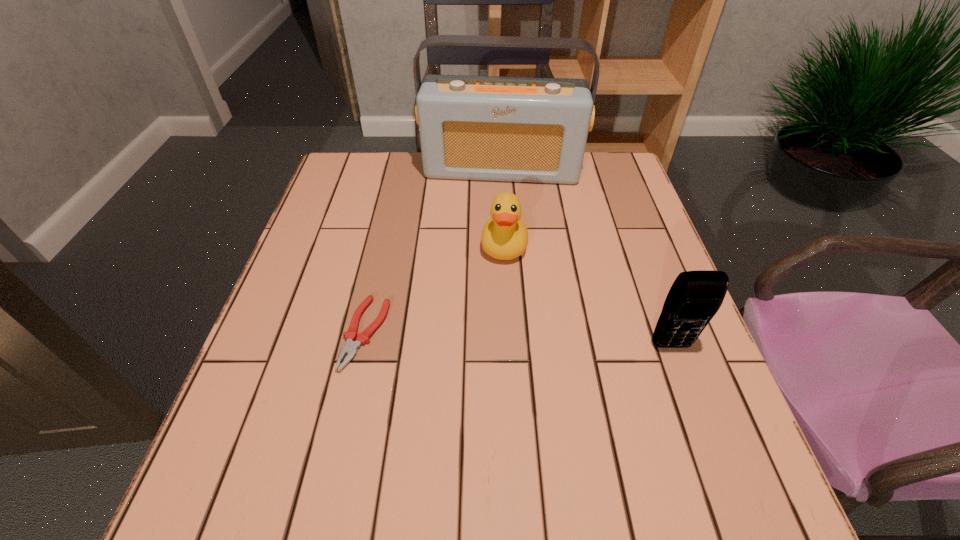
Where is `pliers`? pliers is located at coordinates (350, 348).

Locate an element on the screen. the leftmost object is located at coordinates click(x=350, y=348).

Where is `the third shortest object`? The height and width of the screenshot is (540, 960). the third shortest object is located at coordinates (694, 298).

In order to click on cellular telephone in this screenshot , I will do `click(694, 298)`.

This screenshot has width=960, height=540. Find the location of `the second shortest object`. the second shortest object is located at coordinates (505, 236).

Locate an element on the screen. This screenshot has height=540, width=960. duck is located at coordinates (505, 236).

You are a GUI agent. You are given a task and a screenshot of the screen. Output one action in this format:
    pyautogui.click(x=<x>, y=<y>)
    Task: Click on the radio receiver
    This screenshot has width=960, height=540.
    Given the screenshot: What is the action you would take?
    pyautogui.click(x=520, y=129)

I want to click on the farthest object, so click(x=520, y=129).

Locate an element on the screen. The image size is (960, 540). vacant region located 0.280m on the right of the leftmost object is located at coordinates (520, 333).

Find the location of `vacant point located on the screen of the third shortest object`. vacant point located on the screen of the third shortest object is located at coordinates (687, 390).